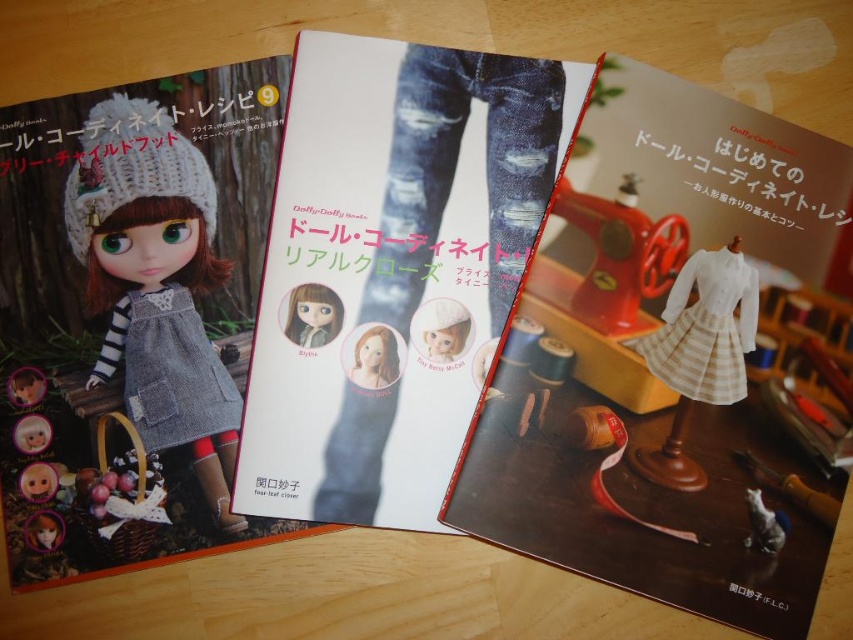
Is point (310, 314) less distant than point (380, 337)?

No, it is not.

Consider the image. Measure the distance from matte gray doll at center to matte plastic doll at center.

matte gray doll at center is 1.31 inches away from matte plastic doll at center.

Describe the element at coordinates (312, 316) in the screenshot. I see `matte gray doll at center` at that location.

Where is `matte gray doll at center`? The width and height of the screenshot is (853, 640). matte gray doll at center is located at coordinates (312, 316).

Between white matte doll at center and matte plastic doll at center, which one is positioned lower?

matte plastic doll at center is lower down.

In the scene shown: Is white matte doll at center wider than matte plastic doll at center?

Indeed, white matte doll at center has a greater width compared to matte plastic doll at center.

This screenshot has height=640, width=853. Find the location of `white matte doll at center`. white matte doll at center is located at coordinates (440, 328).

This screenshot has height=640, width=853. What are the coordinates of `white matte doll at center` in the screenshot? It's located at (440, 328).

Is point (762, 216) closer to camera compared to point (354, 365)?

No, (762, 216) is behind (354, 365).

Which is above, striped fabric dress at center or matte plastic doll at center?

striped fabric dress at center

The height and width of the screenshot is (640, 853). In order to click on striped fabric dress at center in this screenshot , I will do `click(670, 358)`.

The width and height of the screenshot is (853, 640). In order to click on striped fabric dress at center in this screenshot , I will do `click(670, 358)`.